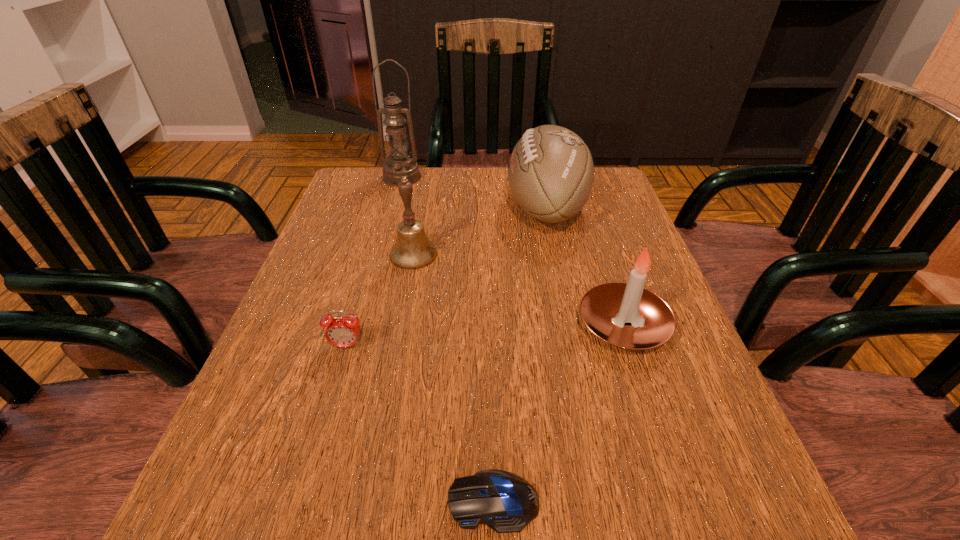
Image resolution: width=960 pixels, height=540 pixels. What are the coordinates of `oil lamp located in the left edge section of the desktop` in the screenshot? It's located at (400, 165).

Image resolution: width=960 pixels, height=540 pixels. In order to click on alarm clock situated at the left edge in this screenshot , I will do `click(341, 331)`.

In order to click on football (American) that is at the right edge in this screenshot , I will do `click(551, 172)`.

The height and width of the screenshot is (540, 960). I want to click on candle that is at the right edge, so click(605, 308).

Locate an element on the screen. object present at the far left corner is located at coordinates (400, 165).

I want to click on object that is at the far right corner, so click(551, 172).

The width and height of the screenshot is (960, 540). I want to click on free space at the far edge of the desktop, so click(x=480, y=176).

Locate an element on the screen. free space at the near edge of the desktop is located at coordinates (611, 510).

This screenshot has width=960, height=540. In the image, there is a desktop. Find the location of `free space at the left edge`. free space at the left edge is located at coordinates (290, 297).

I want to click on free location at the far left corner, so click(347, 179).